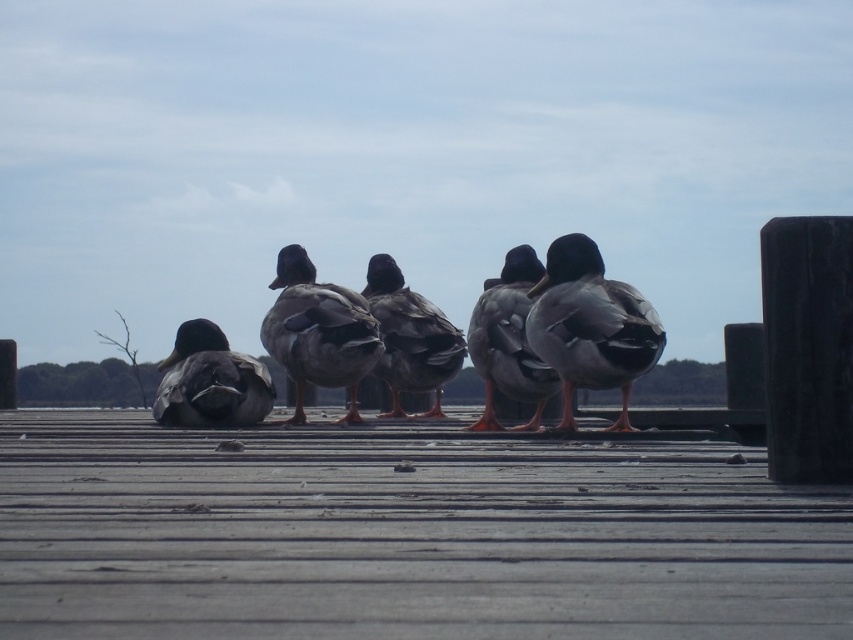
You are a small toy car that is 10 cm long. You want to drive from the wooden planks at center to the dark gray matte duck at left. Can you fit through the space between them?

The wooden planks at center is shorter than dark gray matte duck at left, so the space between them might be too narrow for the toy car to pass through safely. It is recommended to choose a wider path.

You are a wildlife photographer aiming to capture a closeup of the dark gray matte duck at left and the dark brown feathers at center. Your camera has a maximum zoom range that can focus on objects within a 2.0 meters distance. Can you capture both subjects in a single shot without moving the camera?

The dark gray matte duck at left and dark brown feathers at center are 1.82 meters apart from each other, which is within the camera maximum zoom range of 2.0 meters. Therefore, you can capture both subjects in a single shot without moving the camera.

You are a duck standing on the wooden planks at center. You want to move forward to the edge of the dock. Based on your current position, which direction should you face to reach the edge?

The wooden planks at center are positioned at coordinates point (404, 536). To reach the edge of the dock, the duck should face downward since the dock extends downward from the planks.